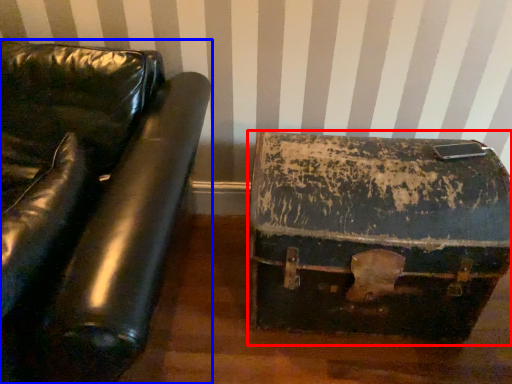
Question: Which point is further to the camera, suitcase (highlighted by a red box) or furniture (highlighted by a blue box)?

Choices:
 (A) suitcase
 (B) furniture

Answer: (A)